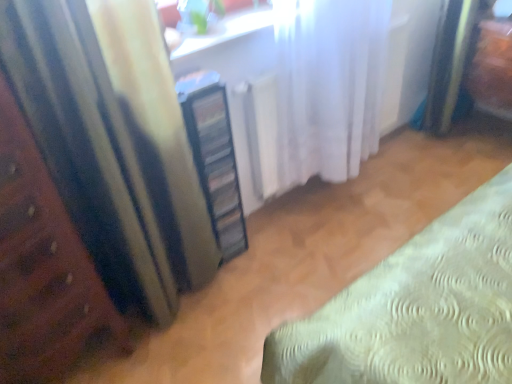
At what (x,y) coordinates should I click in order to perform the action: click on vacant area that is situated to the right of matte yellow curtain at left, the 1th curtain from the left. Please return your answer as a coordinate pair (x, y). Image resolution: width=512 pixels, height=384 pixels. Looking at the image, I should click on (247, 310).